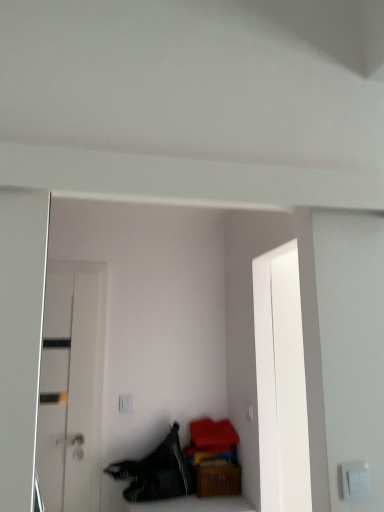
This screenshot has height=512, width=384. I want to click on brown woven basket at lower right, so click(217, 478).

Image resolution: width=384 pixels, height=512 pixels. What do you see at coordinates (217, 478) in the screenshot?
I see `brown woven basket at lower right` at bounding box center [217, 478].

The image size is (384, 512). Identify the location of white plastic switch at lower right. (355, 480).

What is the approximate height of white glossy door at left?

white glossy door at left is 1.34 meters tall.

Identify the location of brown woven basket at lower right. Image resolution: width=384 pixels, height=512 pixels. (217, 478).

At what (x,y) coordinates should I click in order to perform the action: click on electric outlet lying above the white glossy door at left (from the image's perspective). Please return your answer as a coordinate pair (x, y). The height and width of the screenshot is (512, 384). Looking at the image, I should click on (355, 480).

From the image's perspective, is white glossy door at left located above or below white plastic switch at lower right?

From the image's perspective, white glossy door at left appears below white plastic switch at lower right.

Which object is positioned more to the left, white glossy door at left or white plastic switch at lower right?

From the viewer's perspective, white glossy door at left appears more on the left side.

Is black textured fabric at lower left oriented towards white plastic switch at lower right?

Yes, black textured fabric at lower left is turned towards white plastic switch at lower right.

Which is in front, black textured fabric at lower left or white plastic switch at lower right?

white plastic switch at lower right is closer to the camera.

Considering the points (135, 492) and (360, 485), which point is behind, point (135, 492) or point (360, 485)?

The point (135, 492) is more distant.

From the image's perspective, between black textured fabric at lower left and white plastic switch at lower right, who is located below?

black textured fabric at lower left appears lower in the image.

Considering the sizes of objects white plastic switch at lower right and white glossy door at left in the image provided, who is shorter, white plastic switch at lower right or white glossy door at left?

Standing shorter between the two is white plastic switch at lower right.

What are the coordinates of `electric outlet that is above the white glossy door at left (from the image's perspective)` in the screenshot? It's located at (355, 480).

Does white plastic switch at lower right have a greater width compared to white glossy door at left?

No, white plastic switch at lower right is not wider than white glossy door at left.

Is white plastic switch at lower right aimed at white glossy door at left?

No, white plastic switch at lower right is not turned towards white glossy door at left.

Relative to brown woven basket at lower right, is white glossy door at left in front or behind?

white glossy door at left is positioned farther from the viewer than brown woven basket at lower right.

Is white glossy door at left inside or outside of brown woven basket at lower right?

white glossy door at left lies outside brown woven basket at lower right.

Can you confirm if white glossy door at left is smaller than brown woven basket at lower right?

No, white glossy door at left is not smaller than brown woven basket at lower right.

Is brown woven basket at lower right taller than black textured fabric at lower left?

Incorrect, the height of brown woven basket at lower right is not larger of that of black textured fabric at lower left.

How many degrees apart are the facing directions of brown woven basket at lower right and black textured fabric at lower left?

brown woven basket at lower right and black textured fabric at lower left are facing 0.000537 degrees away from each other.

From a real-world perspective, which object rests below the other?

brown woven basket at lower right.

Is point (57, 424) more distant than point (160, 479)?

Yes, it is.

Is black textured fabric at lower left inside white glossy door at left?

That's incorrect, black textured fabric at lower left is not inside white glossy door at left.

Are white glossy door at left and black textured fabric at lower left making contact?

No, white glossy door at left is not next to black textured fabric at lower left.

Between white glossy door at left and black textured fabric at lower left, which one has less height?

black textured fabric at lower left is shorter.

Between black textured fabric at lower left and brown woven basket at lower right, which one appears on the left side from the viewer's perspective?

black textured fabric at lower left.

Considering the points (166, 444) and (208, 474), which point is behind, point (166, 444) or point (208, 474)?

The point (166, 444) is farther from the camera.

From the image's perspective, is black textured fabric at lower left above or below brown woven basket at lower right?

Clearly, from the image's perspective, black textured fabric at lower left is above brown woven basket at lower right.

Looking at this image, is black textured fabric at lower left not close to brown woven basket at lower right?

No, there isn't a large distance between black textured fabric at lower left and brown woven basket at lower right.

This screenshot has height=512, width=384. I want to click on electric outlet below the white glossy door at left (from a real-world perspective), so click(355, 480).

Find the location of `electric outlet above the black textured fabric at lower left (from the image's perspective)`. electric outlet above the black textured fabric at lower left (from the image's perspective) is located at coordinates (355, 480).

Which object lies nearer to the anchor point brown woven basket at lower right, white plastic switch at lower right or black textured fabric at lower left?

black textured fabric at lower left is closer to brown woven basket at lower right.

Which object lies further to the anchor point white glossy door at left, brown woven basket at lower right or black textured fabric at lower left?

The object further to white glossy door at left is brown woven basket at lower right.

Looking at the image, which one is located closer to white plastic switch at lower right, black textured fabric at lower left or white glossy door at left?

black textured fabric at lower left is positioned closer to the anchor white plastic switch at lower right.

When comparing their distances from brown woven basket at lower right, does white glossy door at left or white plastic switch at lower right seem further?

white plastic switch at lower right lies further to brown woven basket at lower right than the other object.

From the image, which object appears to be nearer to white plastic switch at lower right, white glossy door at left or brown woven basket at lower right?

brown woven basket at lower right.

From the image, which object appears to be farther from brown woven basket at lower right, black textured fabric at lower left or white glossy door at left?

white glossy door at left lies further to brown woven basket at lower right than the other object.

Considering their positions, is white plastic switch at lower right positioned closer to black textured fabric at lower left than white glossy door at left?

white glossy door at left lies closer to black textured fabric at lower left than the other object.

Estimate the real-world distances between objects in this image. Which object is closer to black textured fabric at lower left, white plastic switch at lower right or brown woven basket at lower right?

brown woven basket at lower right is positioned closer to the anchor black textured fabric at lower left.

I want to click on clothing between white plastic switch at lower right and brown woven basket at lower right along the z-axis, so click(x=156, y=472).

You are a GUI agent. You are given a task and a screenshot of the screen. Output one action in this format:
    pyautogui.click(x=<x>, y=<y>)
    Task: Click on the clothing between white plastic switch at lower right and white glossy door at left from front to back
    The image size is (384, 512).
    Given the screenshot: What is the action you would take?
    pyautogui.click(x=156, y=472)

Identify the location of clothing between white glossy door at left and brown woven basket at lower right from left to right. The width and height of the screenshot is (384, 512). (156, 472).

The width and height of the screenshot is (384, 512). Find the location of `furniture between white plastic switch at lower right and white glossy door at left from front to back`. furniture between white plastic switch at lower right and white glossy door at left from front to back is located at coordinates (217, 478).